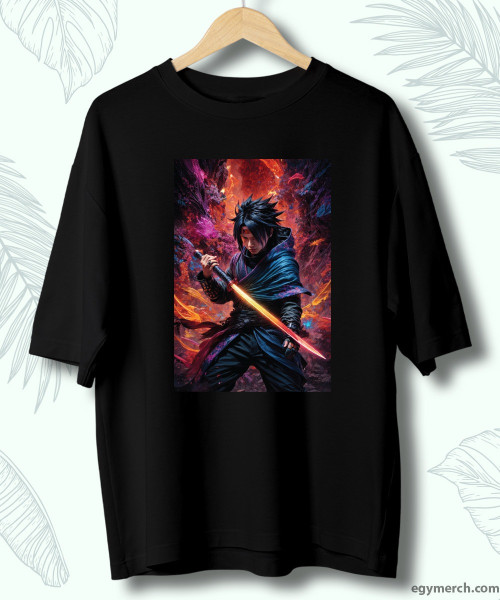
The height and width of the screenshot is (600, 500). What are the coordinates of `metal hanger rod` in the screenshot? It's located at (243, 1).